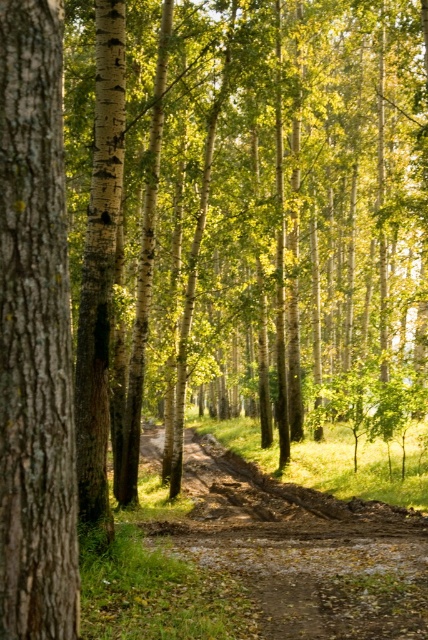
You are a hiker walking along the brown muddy path at center in the forest. You notice the smooth brown bark at left nearby. Which object is closer to you as you walk?

The smooth brown bark at left is closer to the viewer than the brown muddy path at center, so the smooth brown bark at left is closer to you as you walk.

You are a hiker standing on the dirt path in the forest scene. You notice a point marked at coordinates point (35,333). Based on the description, can you determine what surface this point is located on?

The point (35,333) is on smooth brown bark at left, so it is located on the surface of a birch tree.